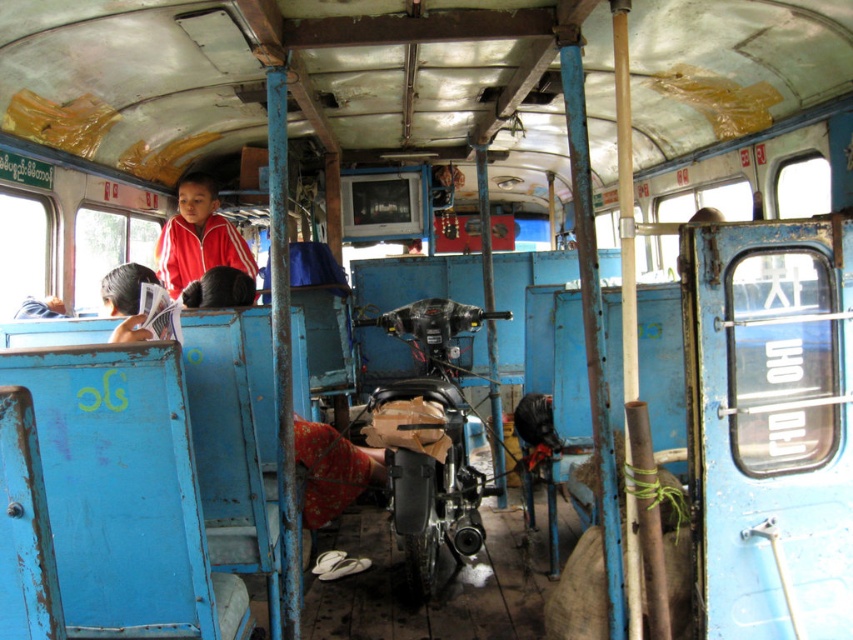
You are a passenger on the bus and want to place your backpack on the floor near the center of the bus. There is a point at coordinates [428,436]. What object is located at that point?

The point at coordinates [428,436] has a matte black motorcycle at center placed there.

You are a delivery person who needs to load a package onto the bus. The bus has a loading area at point 0.683, 0.504. Is the matte black motorcycle at center blocking the loading area?

The matte black motorcycle at center is positioned at point (x=428, y=436), which is exactly where the loading area is located. Therefore, the motorcycle is blocking the loading area.